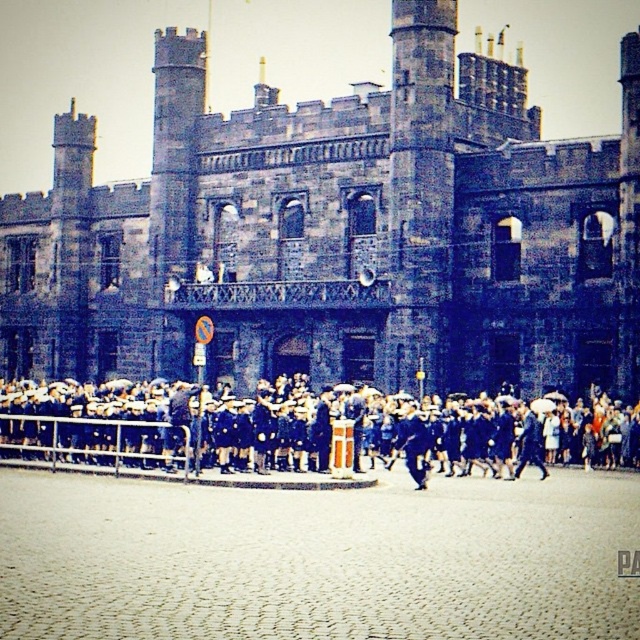
Question: Considering the relative positions of dark stone castle at center and dark blue uniforms at center in the image provided, where is dark stone castle at center located with respect to dark blue uniforms at center?

Choices:
 (A) left
 (B) right

Answer: (B)

Question: Can you confirm if dark stone castle at center is positioned above dark blue uniforms at center?

Choices:
 (A) yes
 (B) no

Answer: (A)

Question: Is dark stone castle at center wider than dark blue uniforms at center?

Choices:
 (A) yes
 (B) no

Answer: (A)

Question: Among these points, which one is nearest to the camera?

Choices:
 (A) (180, 90)
 (B) (445, 458)

Answer: (B)

Question: Among these points, which one is farthest from the camera?

Choices:
 (A) (278, 196)
 (B) (632, 424)

Answer: (A)